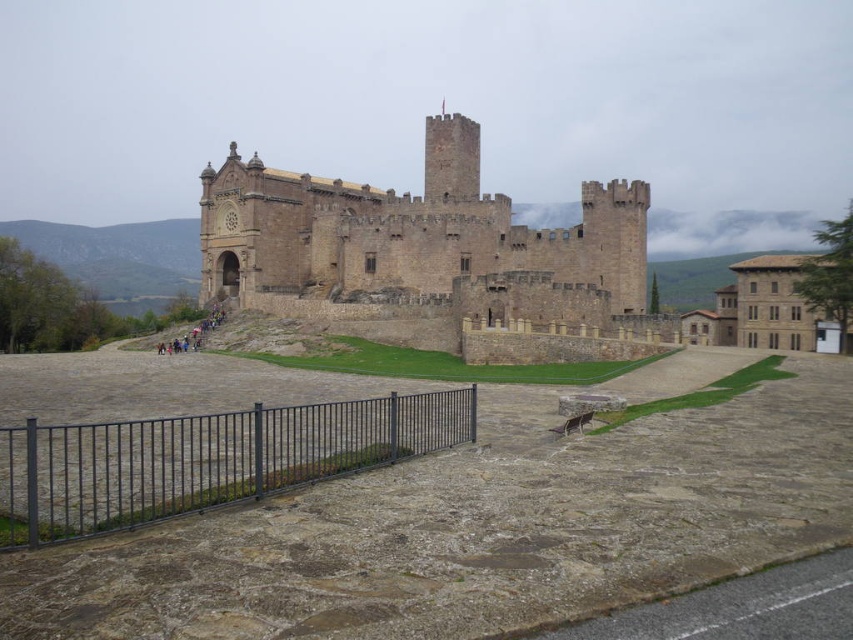
You are standing on the grassy patch near the base of the brown stone castle at center and want to walk to the black metal fence at lower left. Which direction should you head towards?

The brown stone castle at center is located above the black metal fence at lower left, so you should head downward towards the black metal fence at lower left to reach it.

You are a knight approaching the brown stone castle at center and the black metal fence at lower left. From your perspective, which object is positioned to the right?

The brown stone castle at center is positioned to the right of the black metal fence at lower left.